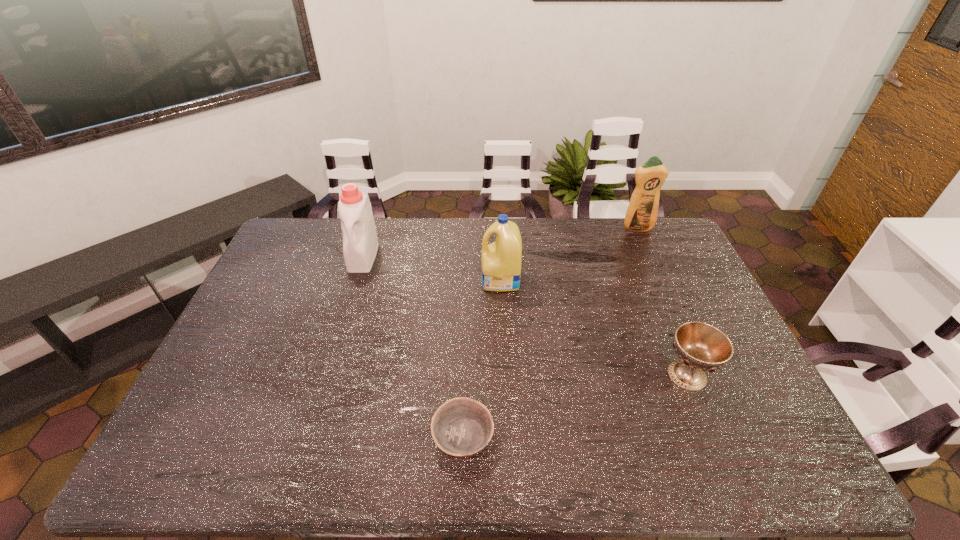
In order to click on free space between the leftmost detergent and the chalice in this screenshot , I will do `click(525, 316)`.

Find the location of `free space between the second detergent from left to right and the second nearest object`. free space between the second detergent from left to right and the second nearest object is located at coordinates (594, 327).

Find the location of a particular element. This screenshot has height=540, width=960. free spot between the leftmost object and the second detergent from right to left is located at coordinates (432, 268).

Identify the location of free space between the bowl and the leftmost object. (413, 346).

Locate an element on the screen. Image resolution: width=960 pixels, height=540 pixels. unoccupied position between the chalice and the second detergent from left to right is located at coordinates (594, 327).

Point out which object is positioned as the second nearest to the second detergent from left to right. Please provide its 2D coordinates. Your answer should be formatted as a tuple, i.e. [(x, y)], where the tuple contains the x and y coordinates of a point satisfying the conditions above.

[(461, 427)]

Locate an element on the screen. the closest object to the bowl is located at coordinates (501, 260).

You are a GUI agent. You are given a task and a screenshot of the screen. Output one action in this format:
    pyautogui.click(x=<x>, y=<y>)
    Task: Click on the detergent identified as the third closest to the second shortest object
    
    Given the screenshot: What is the action you would take?
    pyautogui.click(x=360, y=243)

Image resolution: width=960 pixels, height=540 pixels. In order to click on detergent that stands as the second closest to the rightmost detergent in this screenshot , I will do `click(360, 243)`.

Where is `vacant region that satisfies the following two spatial constraints: 1. on the label of the rightmost detergent; 2. on the label of the second detergent from right to left`? vacant region that satisfies the following two spatial constraints: 1. on the label of the rightmost detergent; 2. on the label of the second detergent from right to left is located at coordinates (660, 280).